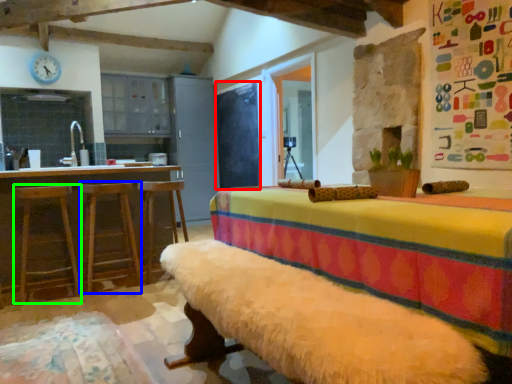
Question: Which object is positioned closest to bulletin board (highlighted by a red box)? Select from bar stool (highlighted by a blue box) and bar stool (highlighted by a green box).

Choices:
 (A) bar stool
 (B) bar stool

Answer: (A)